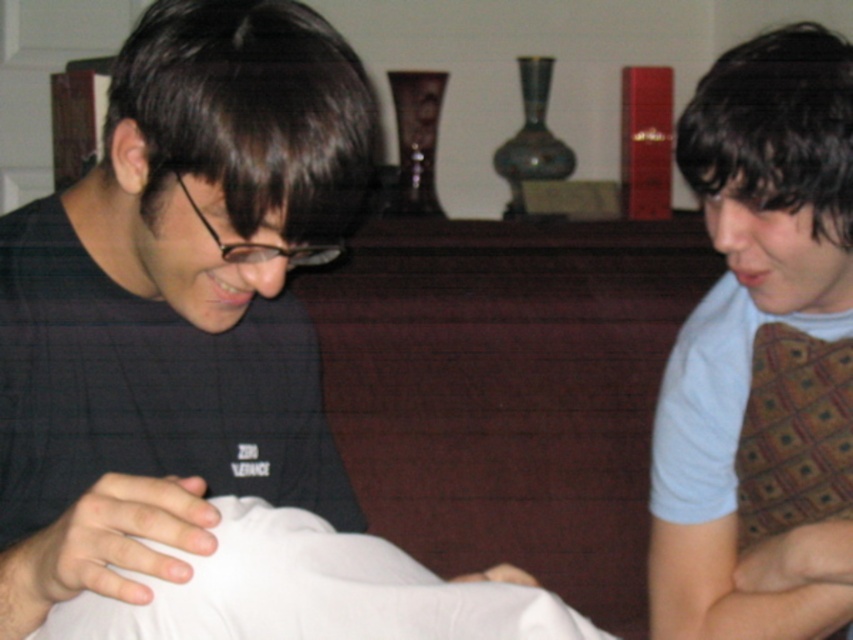
You are standing in the room shown in the image and want to place a small object exactly at the location of the white fabric at center. What are the coordinates where you should place it?

The coordinates for the white fabric at center are at point (204,358).

You are a photographer setting up a shoot in this scene. You need to ensure the white fabric at center does not cover the light blue shirt at right. Based on their current positions, is this possible?

The white fabric at center is positioned over the light blue shirt at right, so it is currently covering it. To avoid covering the shirt, the fabric should be moved to a different position or the shirt moved out from under it.

You are standing in front of the scene. There is a point at coordinates (204, 358). What object is located at this point?

The point at coordinates (204, 358) corresponds to the white fabric at center.